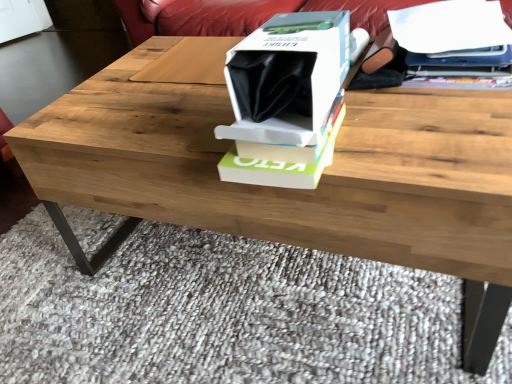
What are the coordinates of `white cardboard box at center` in the screenshot? It's located at (287, 78).

What is the approximate width of white cardboard box at center?

white cardboard box at center is 12.59 inches in width.

The height and width of the screenshot is (384, 512). What do you see at coordinates (287, 78) in the screenshot?
I see `white cardboard box at center` at bounding box center [287, 78].

At what (x,y) coordinates should I click in order to perform the action: click on white cardboard box at center. Please return your answer as a coordinate pair (x, y). The width and height of the screenshot is (512, 384). Looking at the image, I should click on (287, 78).